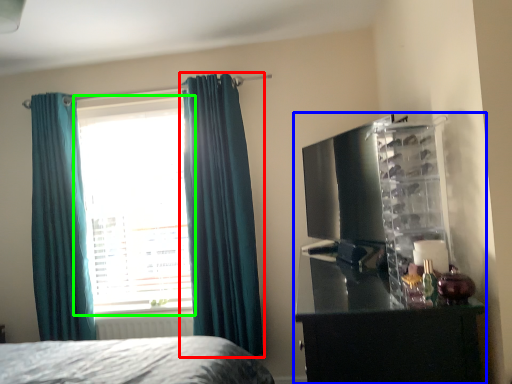
Question: Estimate the real-world distances between objects in this image. Which object is farther from curtain (highlighted by a red box), entertainment center (highlighted by a blue box) or window (highlighted by a green box)?

Choices:
 (A) entertainment center
 (B) window

Answer: (A)